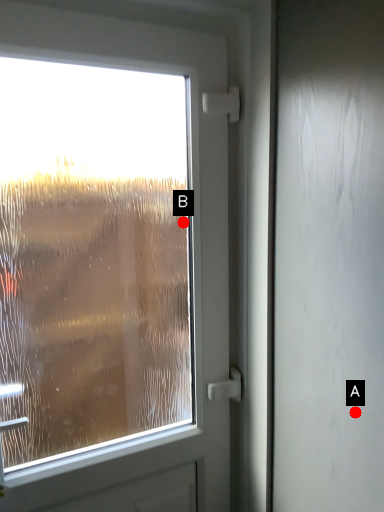
Question: Two points are circled on the image, labeled by A and B beside each circle. Among these points, which one is farthest from the camera?

Choices:
 (A) A is further
 (B) B is further

Answer: (B)